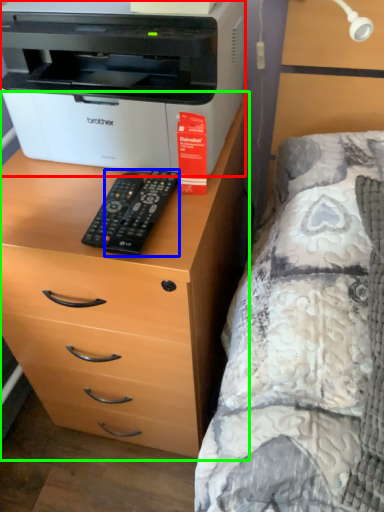
Question: Which object is the closest to the printer (highlighted by a red box)? Choose among these: remote (highlighted by a blue box) or chest of drawers (highlighted by a green box).

Choices:
 (A) remote
 (B) chest of drawers

Answer: (A)